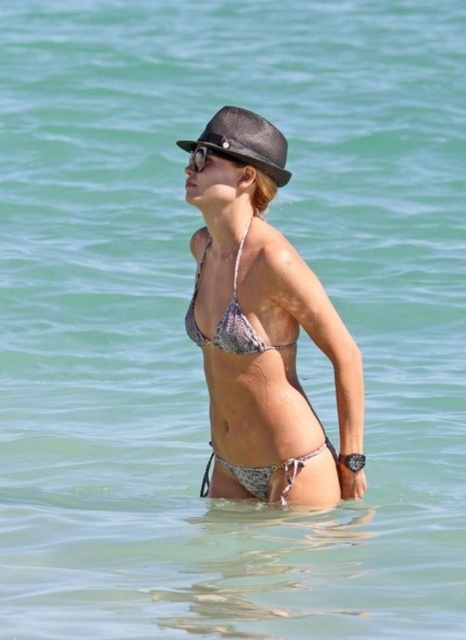
Question: Can you confirm if printed fabric bikini top at center is positioned to the left of black textured sunglasses at upper center?

Choices:
 (A) yes
 (B) no

Answer: (B)

Question: Which of the following is the closest to the observer?

Choices:
 (A) (228, 308)
 (B) (185, 141)
 (C) (287, 369)
 (D) (196, 147)

Answer: (A)

Question: Which point appears farthest from the camera in this image?

Choices:
 (A) (283, 372)
 (B) (196, 342)
 (C) (220, 154)
 (D) (210, 125)

Answer: (B)

Question: Where is printed bikini at center located in relation to black textured sunglasses at upper center in the image?

Choices:
 (A) above
 (B) below

Answer: (B)

Question: Which of these objects is positioned closest to the printed fabric bikini top at center?

Choices:
 (A) printed bikini at center
 (B) black textured sunglasses at upper center

Answer: (A)

Question: Does printed bikini at center have a smaller size compared to matte black fedora at upper center?

Choices:
 (A) no
 (B) yes

Answer: (A)